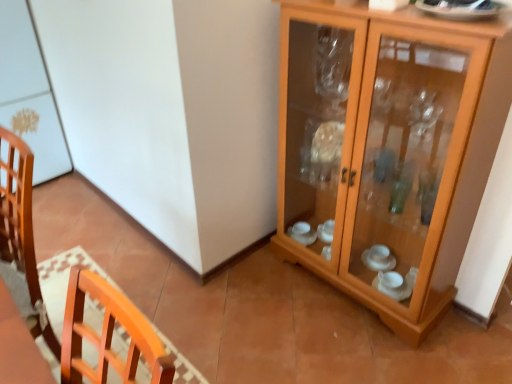
What is the approximate width of wooden cabinet at right?

13.37 inches.

Locate an element on the screen. The width and height of the screenshot is (512, 384). wooden cabinet at right is located at coordinates (387, 149).

Describe the element at coordinates (387, 149) in the screenshot. I see `wooden cabinet at right` at that location.

Locate an element on the screen. The image size is (512, 384). wooden cabinet at right is located at coordinates (387, 149).